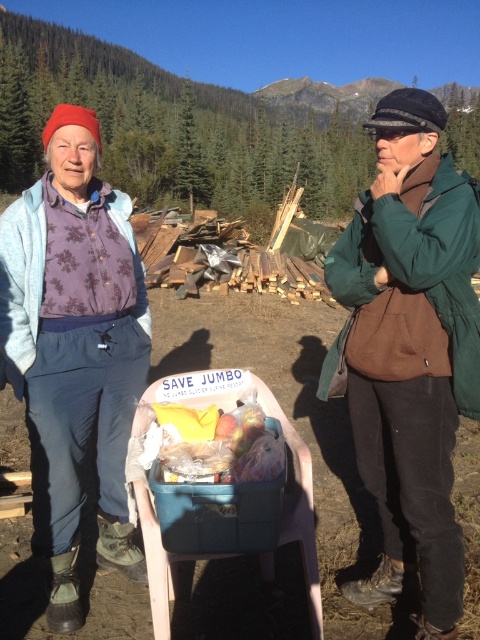
You are planning to wear either the green fuzzy jacket at right or the floral fabric shirt at center for a hike in the mountains. Which one would be more appropriate for the weather?

The green fuzzy jacket at right is bigger and therefore more appropriate for the weather during a mountain hike.

You are trying to decide which clothing item to take for a hike based on their size. You have the green fuzzy jacket at right and the floral fabric shirt at center. Which one has a larger width?

The green fuzzy jacket at right might be wider than floral fabric shirt at center, so it is likely the larger one in terms of width.

You are a hiker trying to decide which path to take. You see the green fuzzy jacket at right and the floral fabric shirt at center. Which one is closer to you?

The green fuzzy jacket at right is closer to you because it is in front of the floral fabric shirt at center.